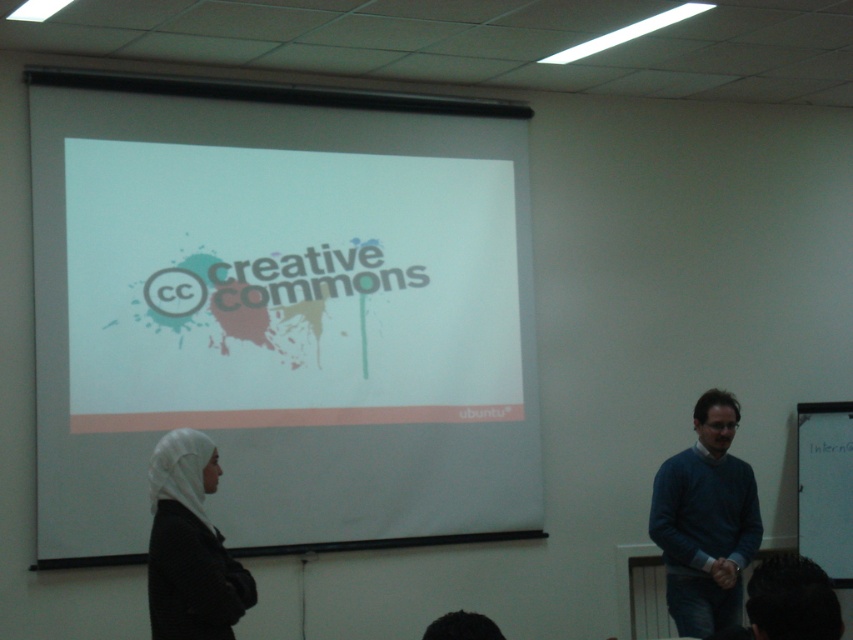
You are an attendee at the presentation and want to take a photo of the white matte projection screen at center and the blue sweater at right. Which object should you focus on first if you want to capture both in one frame without moving the camera?

The white matte projection screen at center is located above the blue sweater at right, so you should focus on the white matte projection screen at center first to ensure both are in frame.

You are standing in the classroom and want to adjust the projector to ensure the image is centered on the white matte projection screen at center. According to the coordinates provided, is the screen already centered in the room?

The white matte projection screen at center is positioned at coordinates point (x=281, y=314), which is very close to the center of the room. Therefore, the screen is already centered.

You are an attendee at the presentation and want to see both the blue sweater at right and the white matte hijab at lower left. Which object is closer to you?

The blue sweater at right is closer to you because it is further to the viewer than the white matte hijab at lower left.